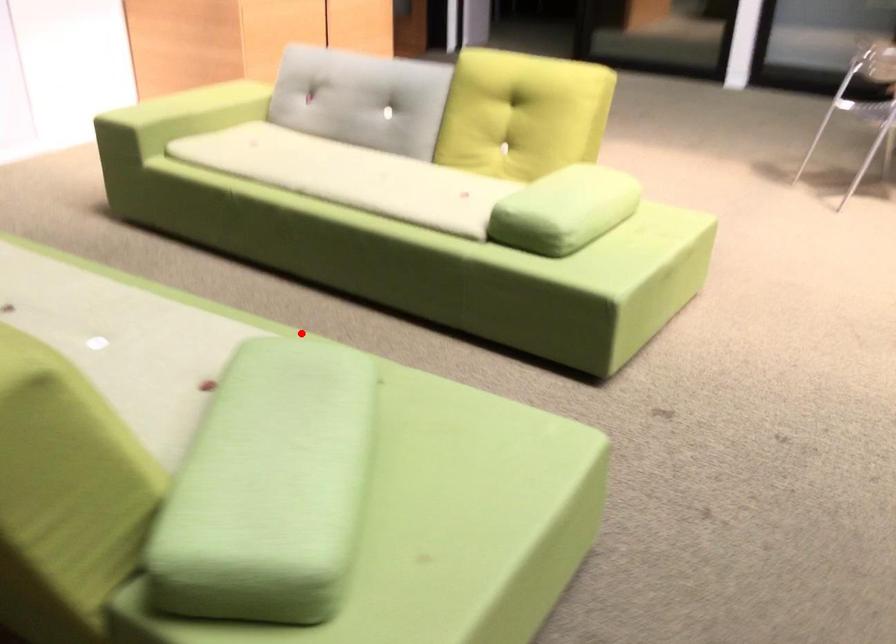
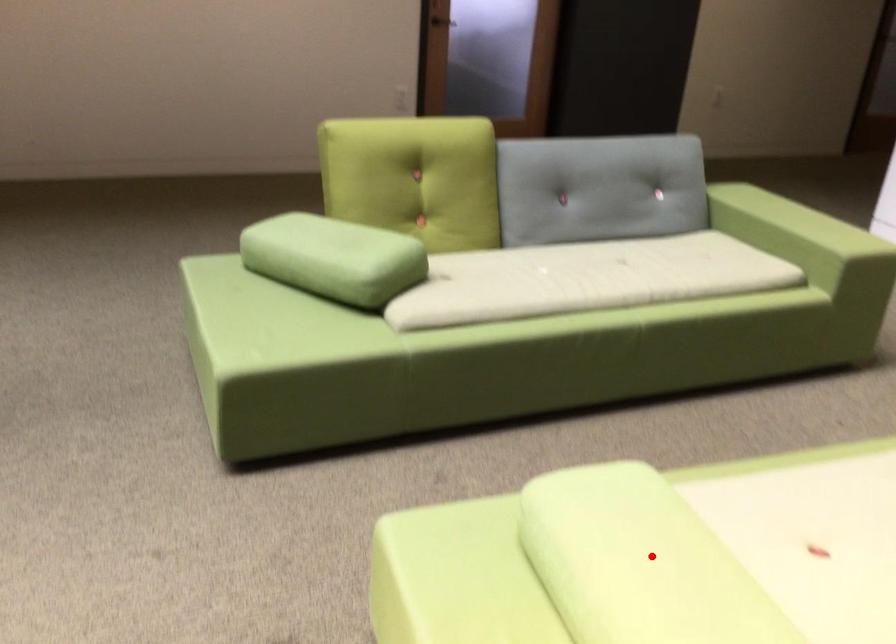
I am providing you with two images of the same scene from different viewpoints. A red point is marked on the first image and another point is marked on the second image. Are the points marked in image1 and image2 representing the same 3D position?

No